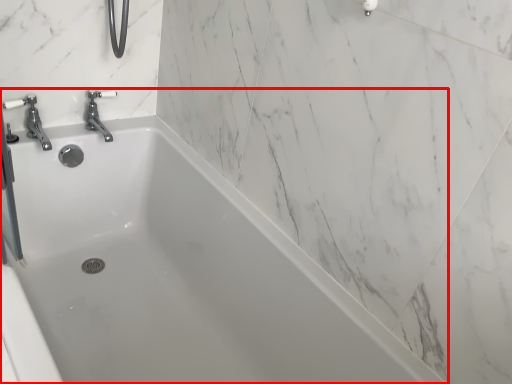
Question: From the image's perspective, what is the correct spatial positioning of bathtub (annotated by the red box) in reference to tap?

Choices:
 (A) below
 (B) above

Answer: (A)